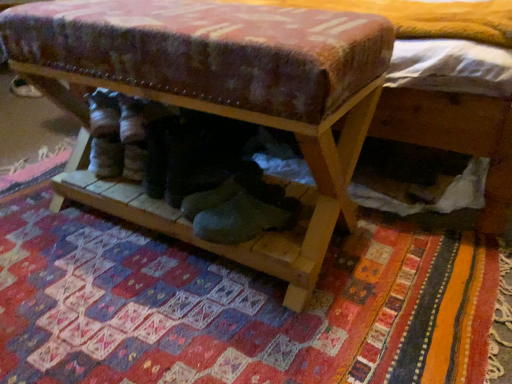
Question: From a real-world perspective, is wooden shoe rack at center physically located above or below white suede shoe at lower left?

Choices:
 (A) above
 (B) below

Answer: (A)

Question: Is wooden shoe rack at center in front of or behind white suede shoe at lower left in the image?

Choices:
 (A) behind
 (B) front

Answer: (B)

Question: Estimate the real-world distances between objects in this image. Which object is closer to the wooden shoe rack at center?

Choices:
 (A) white suede shoe at lower left
 (B) textured woolen mat at center

Answer: (B)

Question: Which of these objects is positioned closest to the white suede shoe at lower left?

Choices:
 (A) wooden shoe rack at center
 (B) textured woolen mat at center

Answer: (A)